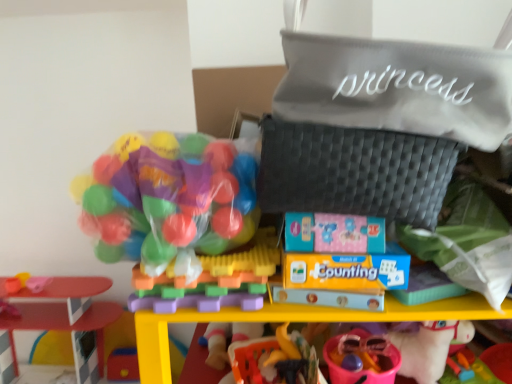
Question: Considering the positions of translucent plastic balls at center, the 3th toy positioned from the left, and rubber duck at lower center, which appears as the second toy when viewed from the right, in the image, is translucent plastic balls at center, the 3th toy positioned from the left, bigger or smaller than rubber duck at lower center, which appears as the second toy when viewed from the right,?

Choices:
 (A) big
 (B) small

Answer: (A)

Question: Would you say translucent plastic balls at center, acting as the third toy starting from the right, is to the left or to the right of rubber duck at lower center, acting as the 4th toy starting from the left, in the picture?

Choices:
 (A) left
 (B) right

Answer: (A)

Question: Estimate the real-world distances between objects in this image. Which object is closer to the smooth plastic table at left, acting as the fifth toy starting from the right?

Choices:
 (A) translucent plastic balls at center, acting as the third toy starting from the right
 (B) rubber duck at lower center, acting as the 4th toy starting from the left
 (C) translucent plastic balls at upper left, which is the 4th toy in right-to-left order
 (D) pink plastic bucket at lower center, the 5th toy viewed from the left

Answer: (B)

Question: Estimate the real-world distances between objects in this image. Which object is farther from the smooth plastic table at left, which is counted as the first toy, starting from the left?

Choices:
 (A) pink plastic bucket at lower center, the 1th toy viewed from the right
 (B) translucent plastic balls at center, the 3th toy positioned from the left
 (C) translucent plastic balls at upper left, which is the 4th toy in right-to-left order
 (D) rubber duck at lower center, which appears as the second toy when viewed from the right

Answer: (A)